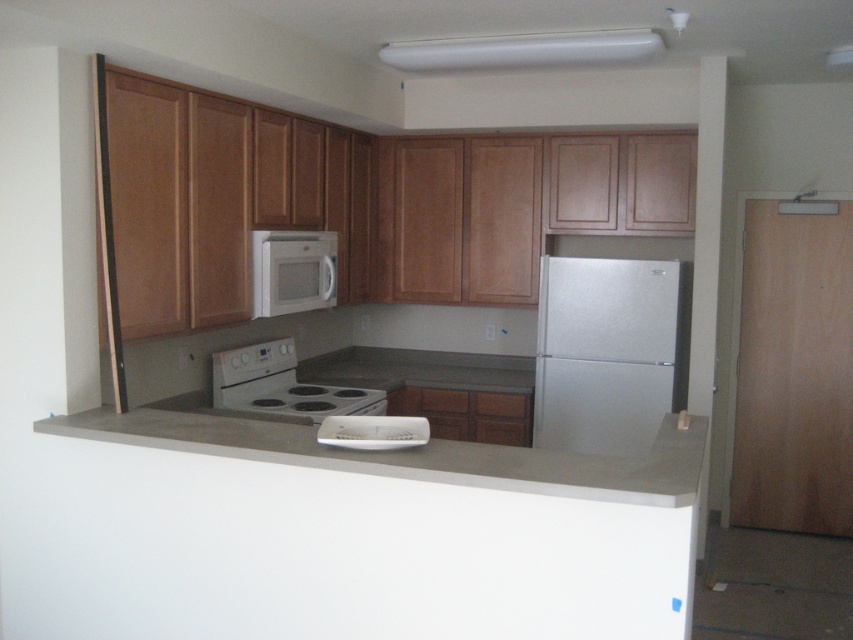
Question: From the image, what is the correct spatial relationship of white glossy electric stove at center in relation to white matte toaster at center?

Choices:
 (A) right
 (B) left

Answer: (B)

Question: Can you confirm if concrete at center is wider than white glossy electric stove at center?

Choices:
 (A) yes
 (B) no

Answer: (A)

Question: Which point appears farthest from the camera in this image?

Choices:
 (A) (610, 493)
 (B) (352, 445)
 (C) (621, 58)
 (D) (619, 273)

Answer: (D)

Question: Does silver metallic refrigerator at right have a smaller size compared to white plastic exhaust hood at upper center?

Choices:
 (A) yes
 (B) no

Answer: (B)

Question: Estimate the real-world distances between objects in this image. Which object is farther from the silver metallic refrigerator at right?

Choices:
 (A) white matte toaster at center
 (B) concrete at center
 (C) white plastic exhaust hood at upper center

Answer: (A)

Question: Among these objects, which one is nearest to the camera?

Choices:
 (A) silver metallic refrigerator at right
 (B) white plastic exhaust hood at upper center
 (C) white glossy electric stove at center
 (D) white matte microwave at center

Answer: (B)